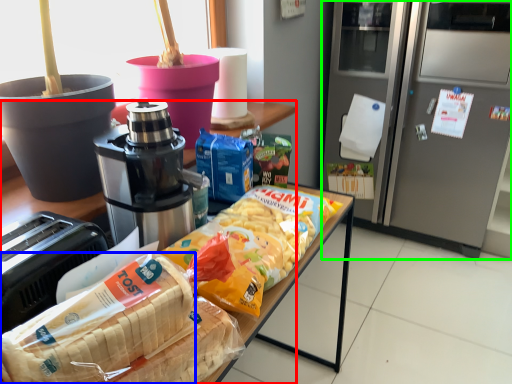
Question: Which object is the farthest from cabinetry (highlighted by a red box)? Choose among these: cereal (highlighted by a blue box) or home appliance (highlighted by a green box).

Choices:
 (A) cereal
 (B) home appliance

Answer: (B)